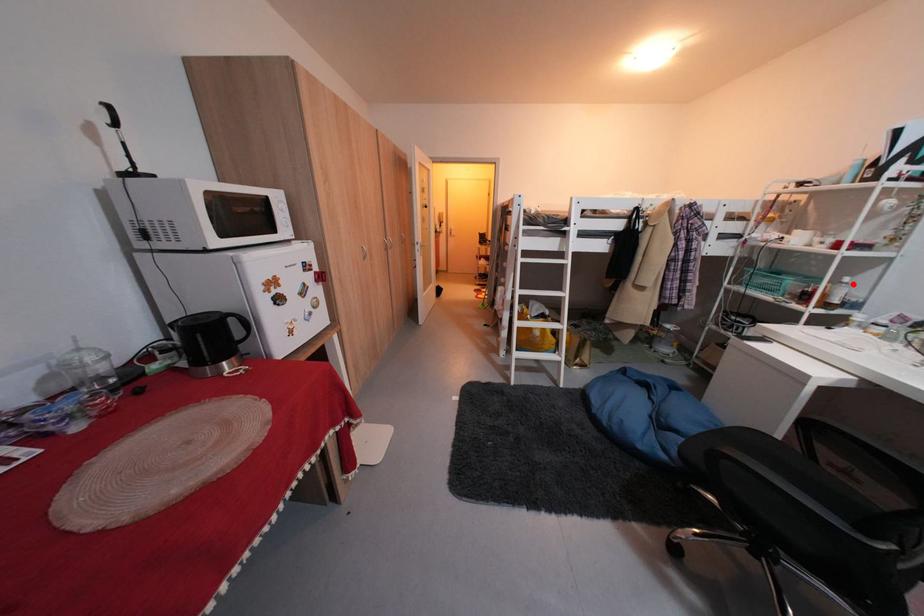
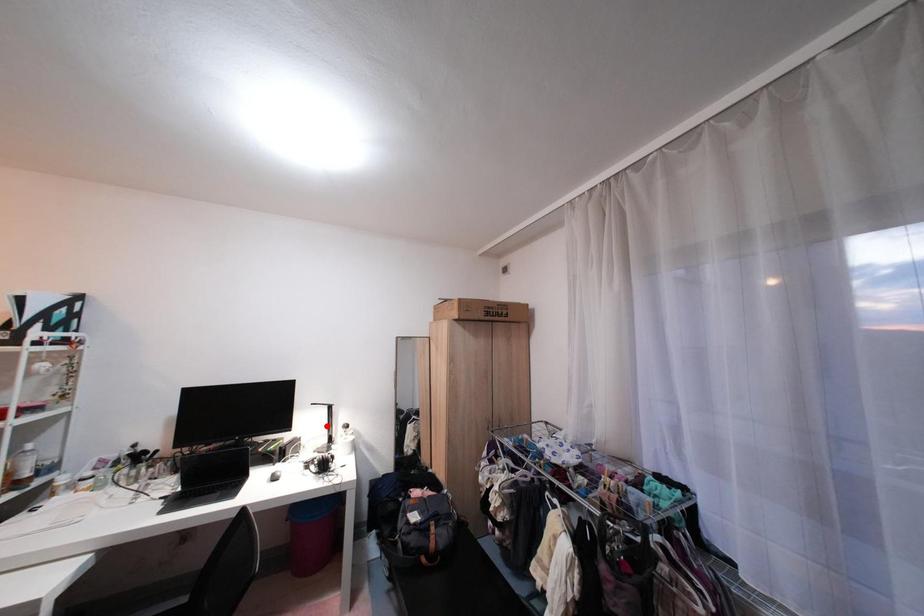
I am providing you with two images of the same scene from different viewpoints. A red point is marked on the first image and another point is marked on the second image. Are the points marked in image1 and image2 representing the same 3D position?

No